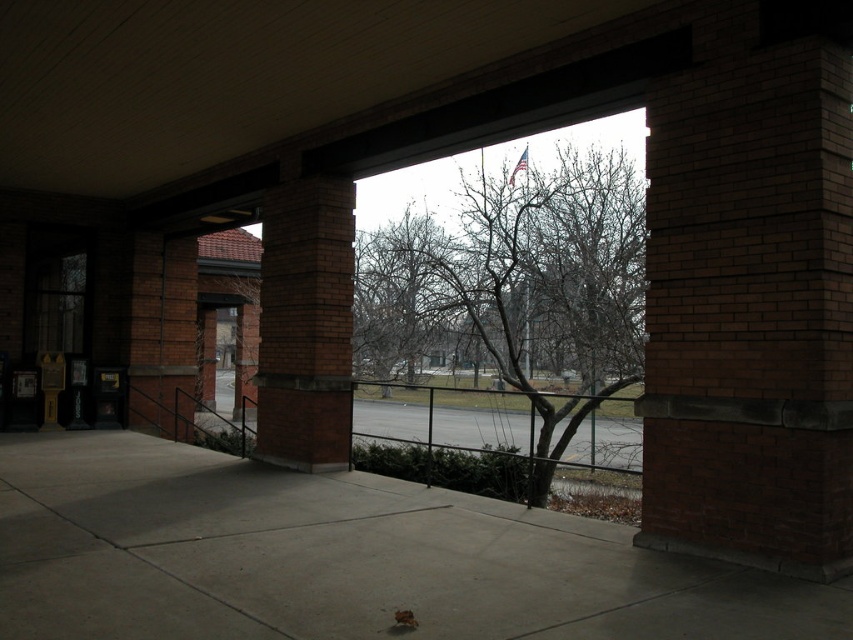
Question: Which point appears farthest from the camera in this image?

Choices:
 (A) (293, 456)
 (B) (366, 352)
 (C) (56, 438)

Answer: (B)

Question: Is concrete at center to the left of bare branches at center from the viewer's perspective?

Choices:
 (A) yes
 (B) no

Answer: (A)

Question: Estimate the real-world distances between objects in this image. Which object is closer to the brown brick column at center?

Choices:
 (A) bare branches at center
 (B) concrete at center

Answer: (A)

Question: Which of the following is the closest to the observer?

Choices:
 (A) brown brick column at center
 (B) concrete at center
 (C) bare branches at center

Answer: (B)

Question: In this image, where is concrete at center located relative to bare branches at center?

Choices:
 (A) below
 (B) above

Answer: (A)

Question: Can you confirm if bare branches at center is positioned above brown brick column at center?

Choices:
 (A) yes
 (B) no

Answer: (B)